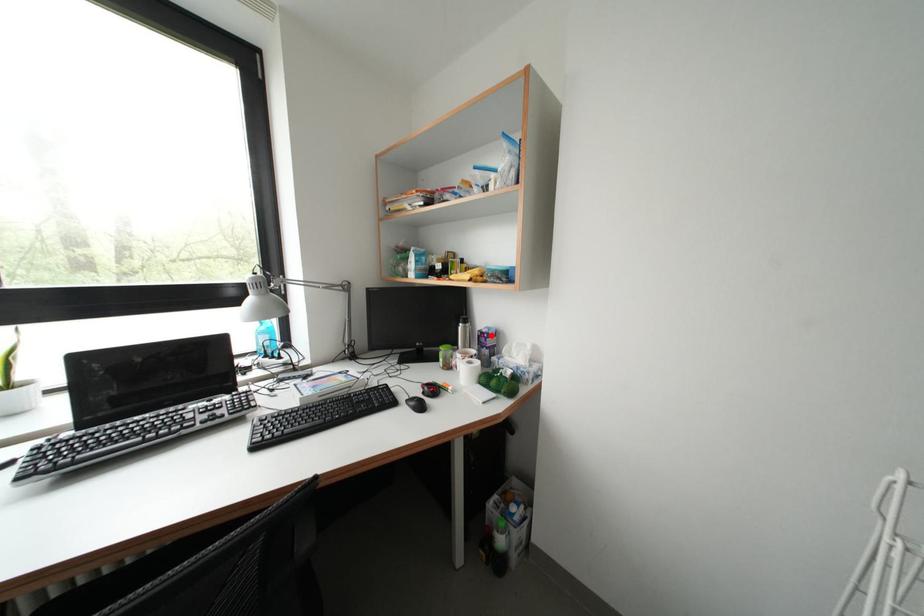
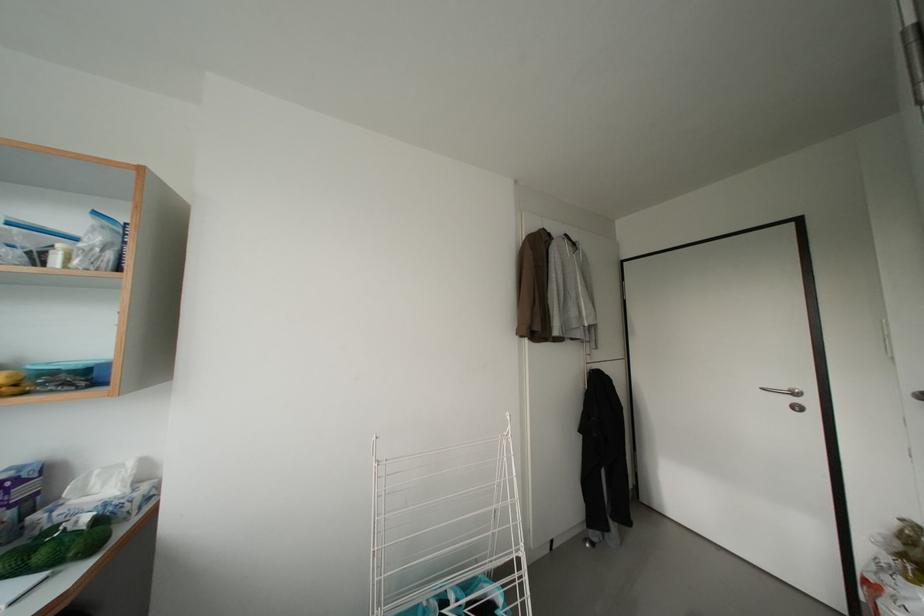
In the second image, find the point that corresponds to the highlighted location in the first image.

(11, 482)